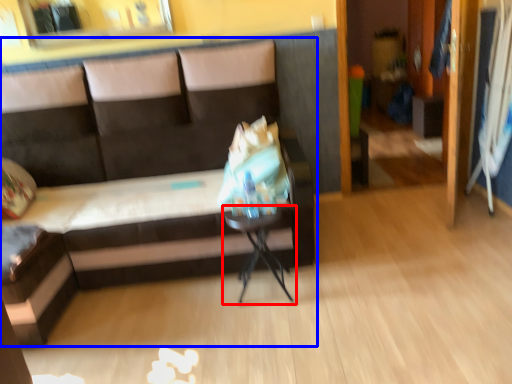
Question: Which point is closer to the camera, table (highlighted by a red box) or studio couch (highlighted by a blue box)?

Choices:
 (A) table
 (B) studio couch

Answer: (B)